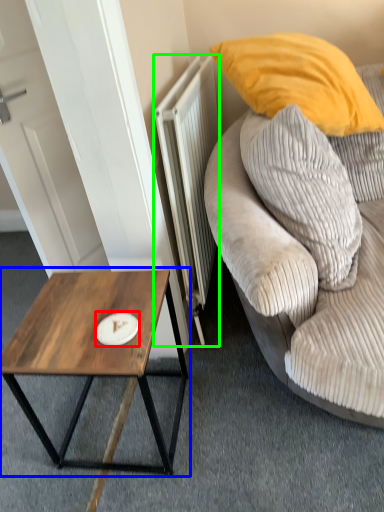
Question: Which object is positioned closest to plate (highlighted by a red box)? Select from coffee table (highlighted by a blue box) and radiator (highlighted by a green box).

Choices:
 (A) coffee table
 (B) radiator

Answer: (A)